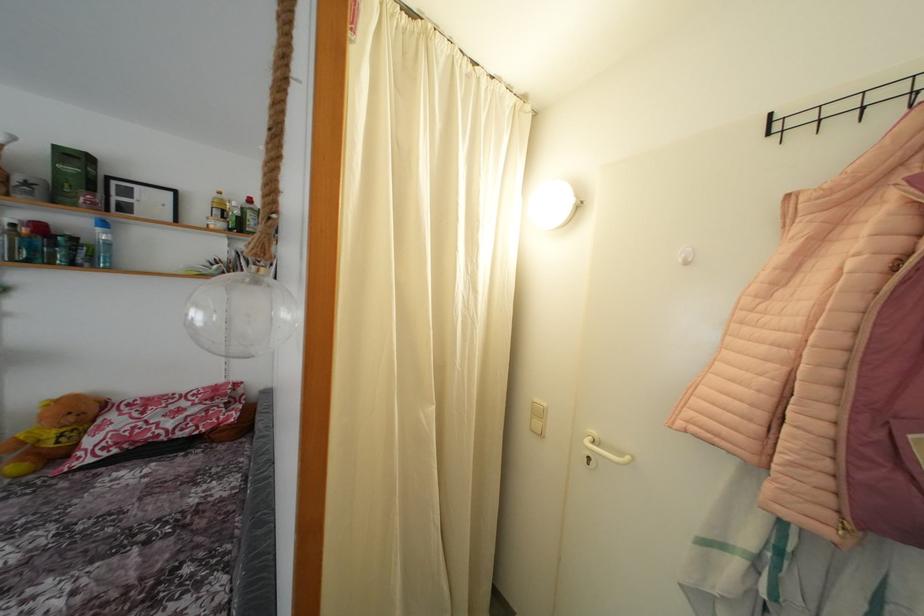
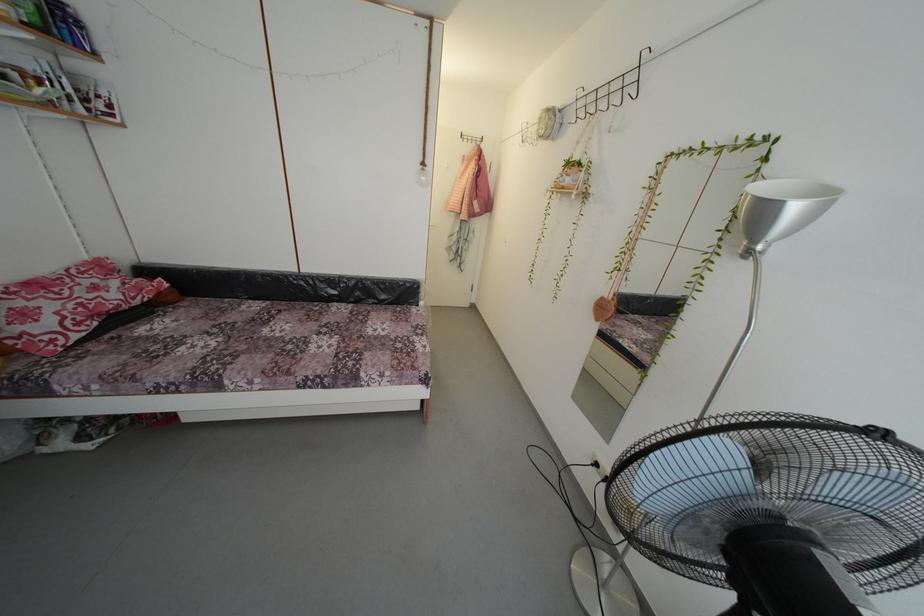
The point at (126, 421) is marked in the first image. Where is the corresponding point in the second image?

(34, 306)